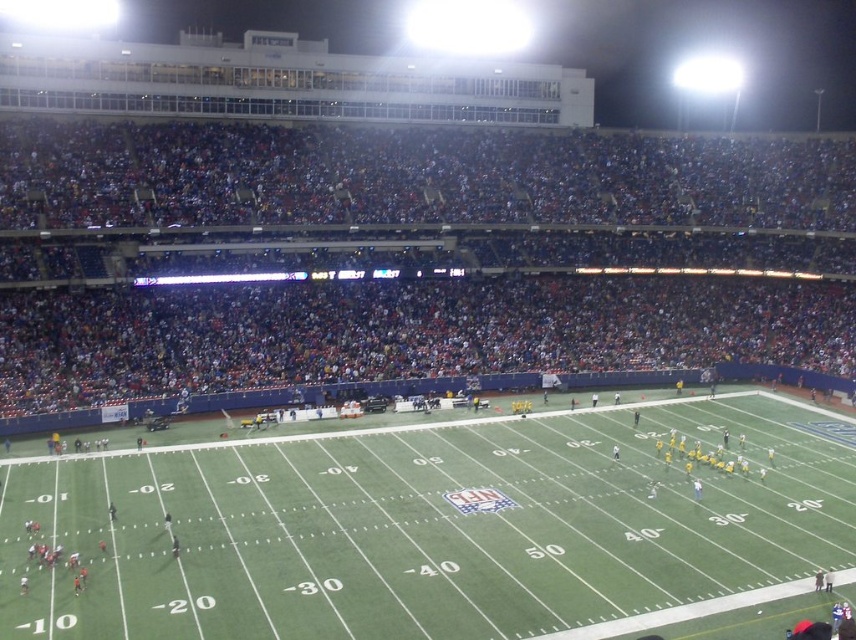
Who is positioned more to the right, green turf football field at center or dark blue seats at upper center?

Positioned to the right is dark blue seats at upper center.

Where is `green turf football field at center`? Image resolution: width=856 pixels, height=640 pixels. green turf football field at center is located at coordinates (431, 528).